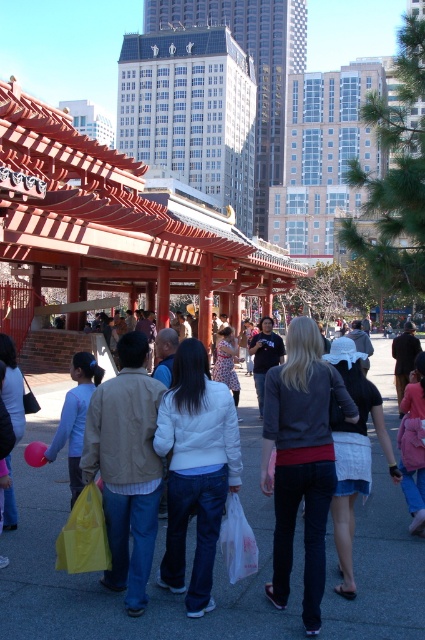
Which is behind, point (272, 369) or point (209, 461)?

The point (272, 369) is more distant.

Consider the image. Is dark gray sweater at center above white matte jacket at center?

Yes, dark gray sweater at center is above white matte jacket at center.

Describe the element at coordinates (300, 460) in the screenshot. I see `dark gray sweater at center` at that location.

I want to click on dark gray sweater at center, so click(300, 460).

Between white matte jacket at center and yellow plastic bag at lower left, which one is positioned lower?

yellow plastic bag at lower left is lower down.

Which of these two, white matte jacket at center or yellow plastic bag at lower left, stands shorter?

Standing shorter between the two is yellow plastic bag at lower left.

This screenshot has width=425, height=640. I want to click on white matte jacket at center, so click(195, 468).

At what (x,y) coordinates should I click in order to perform the action: click on white matte jacket at center. Please return your answer as a coordinate pair (x, y). Looking at the image, I should click on 195,468.

Is smooth glass skyscraper at upper center further to the viewer compared to yellow plastic bag at lower left?

Yes, it is behind yellow plastic bag at lower left.

Between smooth glass skyscraper at upper center and yellow plastic bag at lower left, which one is positioned lower?

yellow plastic bag at lower left is below.

Between point (303, 67) and point (79, 561), which one is positioned behind?

Point (303, 67)

At what (x,y) coordinates should I click in order to perform the action: click on smooth glass skyscraper at upper center. Please return your answer as a coordinate pair (x, y). Looking at the image, I should click on (254, 65).